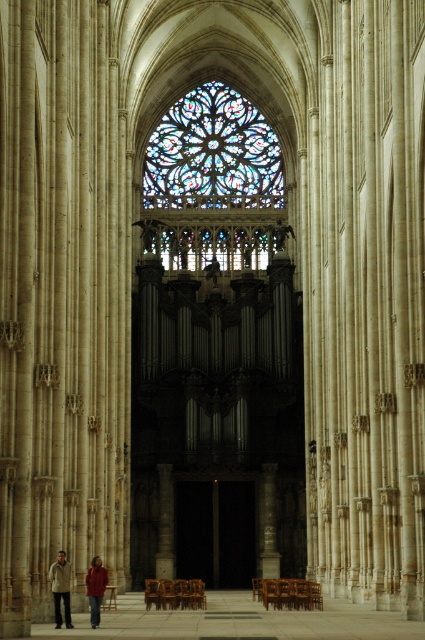
Who is lower down, stained glass at upper center or red sweater at lower left?

red sweater at lower left

Can you confirm if stained glass at upper center is positioned above red sweater at lower left?

Correct, stained glass at upper center is located above red sweater at lower left.

Which is in front, point (255, 145) or point (93, 596)?

Point (93, 596)

At what (x,y) coordinates should I click in order to perform the action: click on stained glass at upper center. Please return your answer as a coordinate pair (x, y). Image resolution: width=425 pixels, height=640 pixels. Looking at the image, I should click on (212, 154).

Can you confirm if khaki cotton shirt at lower left is positioned to the right of red sweater at lower left?

Incorrect, khaki cotton shirt at lower left is not on the right side of red sweater at lower left.

Is khaki cotton shirt at lower left below red sweater at lower left?

No.

Which is behind, point (65, 556) or point (99, 588)?

The point (99, 588) is behind.

Find the location of a particular element. This screenshot has height=640, width=425. khaki cotton shirt at lower left is located at coordinates (61, 588).

Describe the element at coordinates (212, 154) in the screenshot. This screenshot has width=425, height=640. I see `stained glass at upper center` at that location.

Can you confirm if stained glass at upper center is thinner than khaki cotton shirt at lower left?

No, stained glass at upper center is not thinner than khaki cotton shirt at lower left.

Which is in front, point (255, 131) or point (57, 625)?

Point (57, 625)

This screenshot has width=425, height=640. I want to click on stained glass at upper center, so click(212, 154).